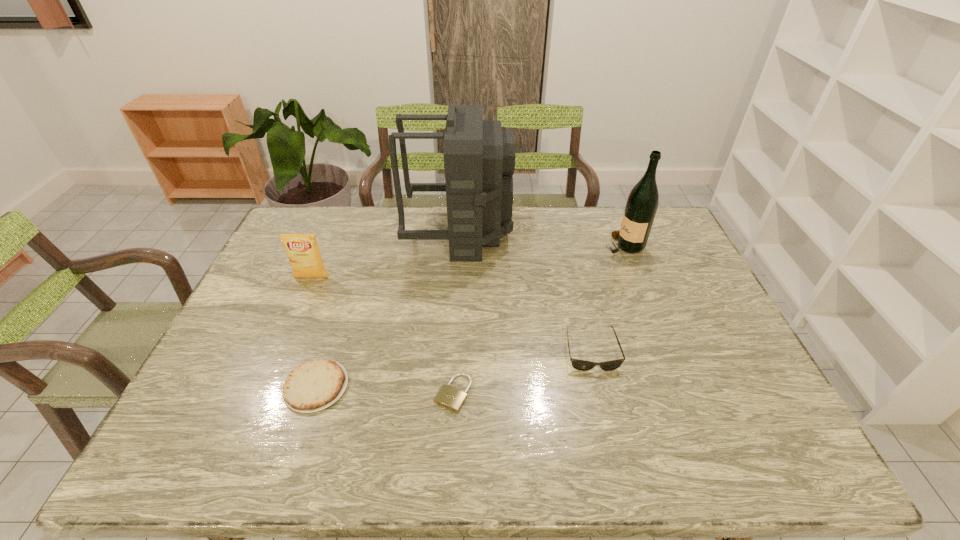
Identify the location of free space between the third tallest object and the fifth tallest object. The image size is (960, 540). (314, 332).

What are the coordinates of `vacant area between the padlock and the wine bottle` in the screenshot? It's located at (539, 319).

Where is `vacant area between the fourth tallest object and the wine bottle`? vacant area between the fourth tallest object and the wine bottle is located at coordinates (607, 297).

Identify which object is the third nearest to the fifth tallest object. Please provide its 2D coordinates. Your answer should be formatted as a tuple, i.e. [(x, y)], where the tuple contains the x and y coordinates of a point satisfying the conditions above.

[(479, 157)]

Locate which object ranks third in proximity to the shortest object. Please provide its 2D coordinates. Your answer should be formatted as a tuple, i.e. [(x, y)], where the tuple contains the x and y coordinates of a point satisfying the conditions above.

[(479, 157)]

Find the location of a particular element. vacant point that satisfies the following two spatial constraints: 1. on the front of the fourth nearest object with the logo; 2. on the left side of the tortilla is located at coordinates (266, 387).

Image resolution: width=960 pixels, height=540 pixels. What are the coordinates of `free space that satisfies the following two spatial constraints: 1. on the front of the third farthest object with the logo; 2. on the left side of the shortest object` in the screenshot? It's located at (263, 393).

This screenshot has height=540, width=960. Identify the location of vacant space that satisfies the following two spatial constraints: 1. on the back side of the padlock; 2. on the front compartment of the backpack. (462, 233).